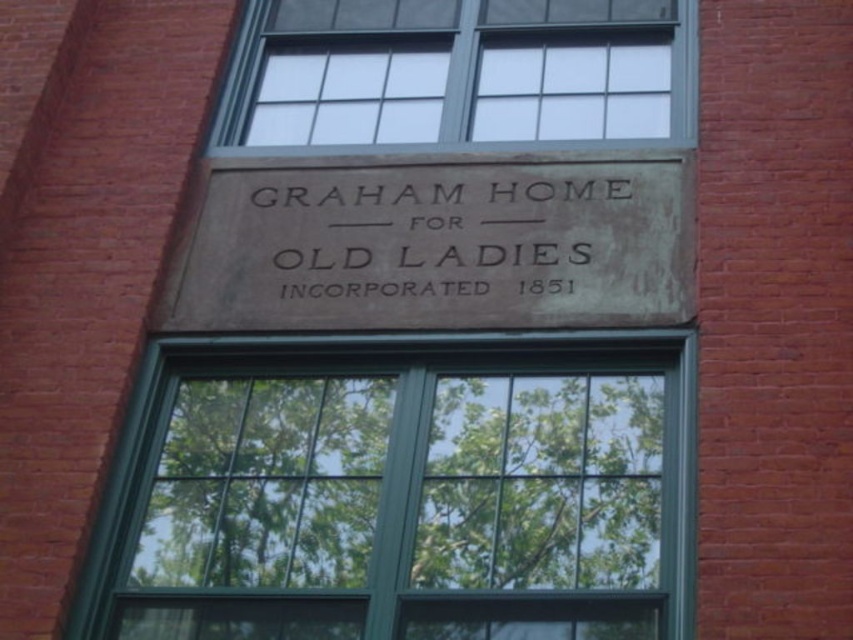
You are standing in front of the brick building and want to touch both points on the window and plaque. Which point should you reach for first, the point at coordinate (601, 131) or the point at coordinate (392, 186)?

You should reach for the point at coordinate (392, 186) first because it is closer to you than the point at coordinate (601, 131), which is further away.

You are standing in front of a brick building and see the green glass window at center and the dark gray stone sign at center. Which object is positioned to the left from your perspective?

The green glass window at center is to the left of the dark gray stone sign at center.